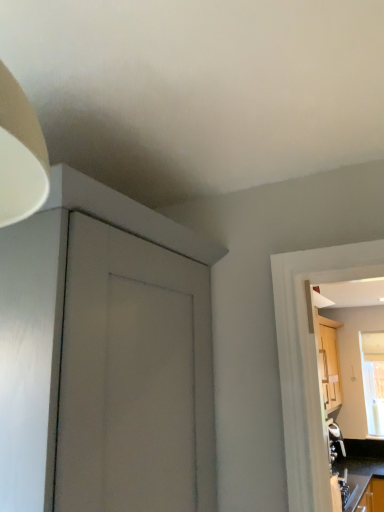
Measure the distance between point (209, 272) and camera.

1.31 meters.

Image resolution: width=384 pixels, height=512 pixels. Find the location of `matte gray cabinet at upper left`. matte gray cabinet at upper left is located at coordinates (105, 357).

Describe the element at coordinates (105, 357) in the screenshot. This screenshot has height=512, width=384. I see `matte gray cabinet at upper left` at that location.

Image resolution: width=384 pixels, height=512 pixels. I want to click on matte gray cabinet at upper left, so click(x=105, y=357).